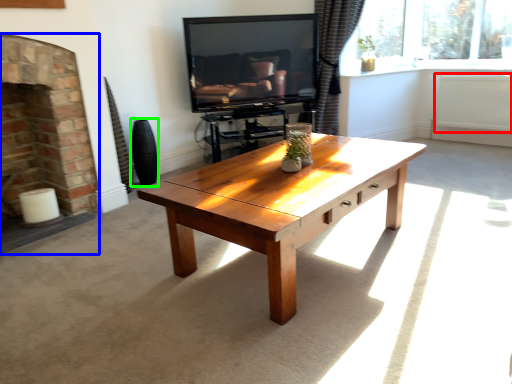
Question: Considering the real-world distances, which object is farthest from radiator (highlighted by a red box)? fireplace (highlighted by a blue box) or vase (highlighted by a green box)?

Choices:
 (A) fireplace
 (B) vase

Answer: (A)